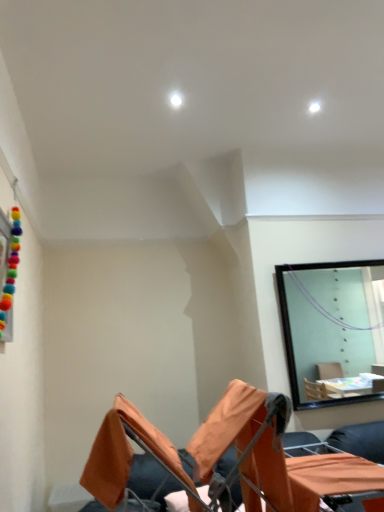
Question: In the image, is orange fabric chair at lower center positioned in front of or behind orange fabric table at lower right?

Choices:
 (A) behind
 (B) front

Answer: (B)

Question: Is point (216, 458) positioned closer to the camera than point (299, 460)?

Choices:
 (A) farther
 (B) closer

Answer: (B)

Question: From their relative heights in the image, would you say orange fabric chair at lower center is taller or shorter than orange fabric table at lower right?

Choices:
 (A) short
 (B) tall

Answer: (B)

Question: Is orange fabric table at lower right bigger or smaller than orange fabric chair at lower center?

Choices:
 (A) small
 (B) big

Answer: (A)

Question: Is orange fabric table at lower right spatially inside orange fabric chair at lower center, or outside of it?

Choices:
 (A) outside
 (B) inside

Answer: (B)

Question: Looking at their shapes, would you say orange fabric table at lower right is wider or thinner than orange fabric chair at lower center?

Choices:
 (A) wide
 (B) thin

Answer: (B)

Question: From the image's perspective, is orange fabric table at lower right located above or below orange fabric chair at lower center?

Choices:
 (A) above
 (B) below

Answer: (B)